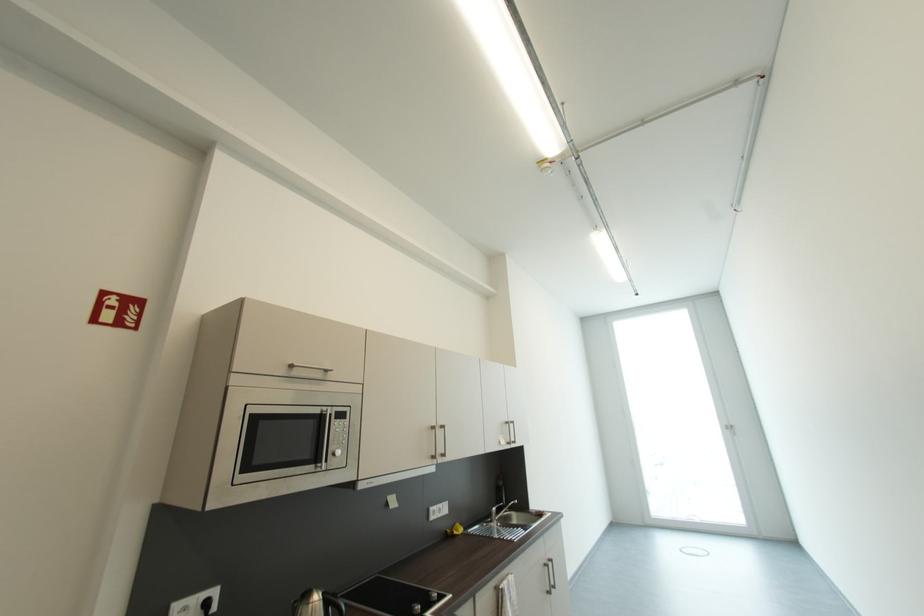
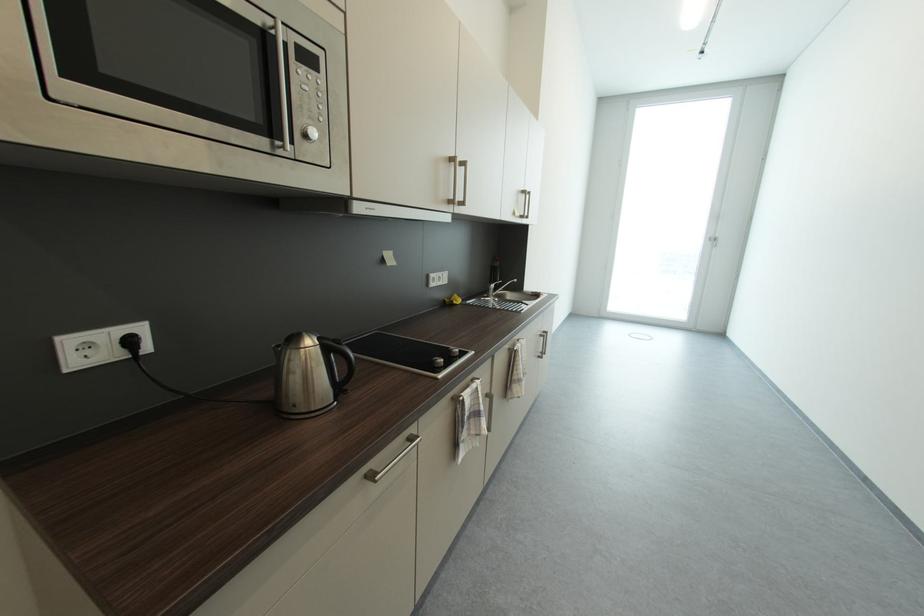
Where in the second image is the point corresponding to (x=436, y=431) from the first image?

(455, 164)